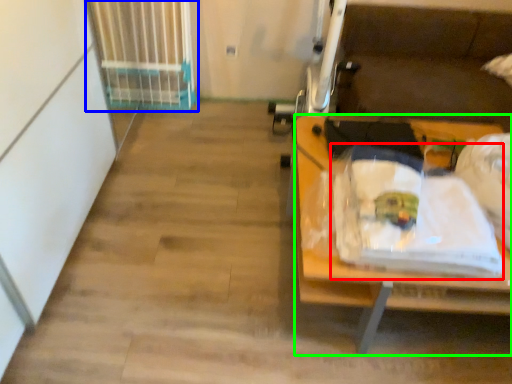
Question: Which object is positioned farthest from waste (highlighted by a red box)? Select from radiator (highlighted by a blue box) and desk (highlighted by a green box).

Choices:
 (A) radiator
 (B) desk

Answer: (A)